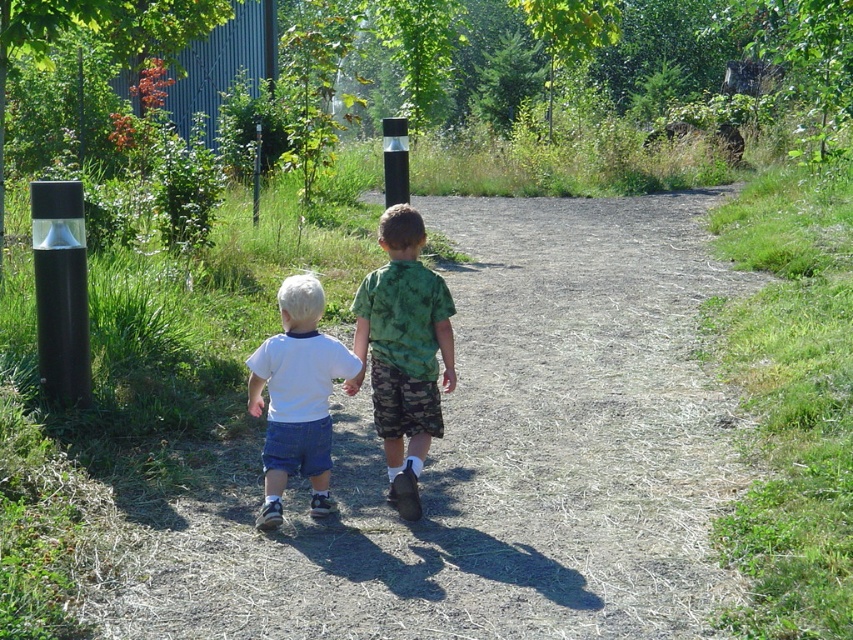
Looking at this image, you are standing at the starting point of the dirt path in the park. You see two points marked on the path ahead of you. The first point is at coordinates point (677, 419) and the second is at point (271, 481). If you walk forward along the path, which point will you encounter first?

The point at point (271, 481) will be encountered first because it is in front of point (677, 419) along the path.

You are standing at the starting point of the dirt path. The coordinates of the brown dirt path at center are given. If you want to walk straight along the path, which direction should you head towards?

Since the brown dirt path at center is located at coordinates point [495,458], you should head towards the direction where the path curves gently to the right as described in the scene.